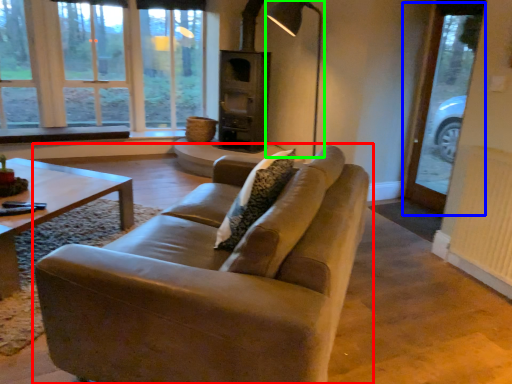
Question: Which object is positioned closest to studio couch (highlighted by a red box)? Select from screen door (highlighted by a blue box) and lamp (highlighted by a green box).

Choices:
 (A) screen door
 (B) lamp

Answer: (A)